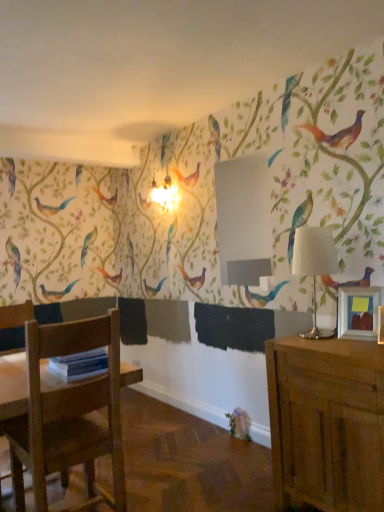
Question: From a real-world perspective, is wooden chair at lower left positioned above or below wooden cabinet at right?

Choices:
 (A) above
 (B) below

Answer: (A)

Question: From the image's perspective, is wooden chair at lower left positioned above or below wooden cabinet at right?

Choices:
 (A) below
 (B) above

Answer: (B)

Question: Which is farther from the wooden picture frame at right?

Choices:
 (A) wooden cabinet at right
 (B) white fabric lampshade at right
 (C) wooden chair at lower left

Answer: (C)

Question: Which is nearer to the white fabric lampshade at right?

Choices:
 (A) wooden cabinet at right
 (B) wooden picture frame at right
 (C) wooden chair at lower left

Answer: (B)